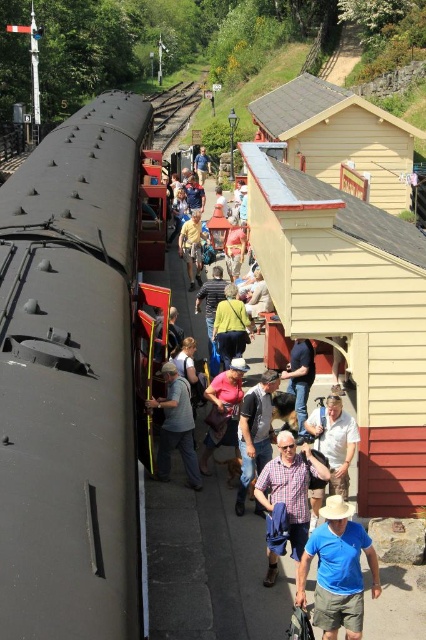
Who is more distant from viewer, (31, 472) or (181, 445)?

Positioned behind is point (181, 445).

Does point (14, 438) come farther from viewer compared to point (164, 403)?

No, it is not.

What do you see at coordinates (71, 380) in the screenshot?
I see `matte black train at left` at bounding box center [71, 380].

Find the location of a particular element. The height and width of the screenshot is (640, 426). matte black train at left is located at coordinates (71, 380).

Does matte black train at left have a greater height compared to matte black train at center?

Indeed, matte black train at left has a greater height compared to matte black train at center.

This screenshot has height=640, width=426. Find the location of `matte black train at left`. matte black train at left is located at coordinates (71, 380).

The width and height of the screenshot is (426, 640). What do you see at coordinates (71, 380) in the screenshot?
I see `matte black train at left` at bounding box center [71, 380].

This screenshot has width=426, height=640. Identify the location of matte black train at left. (71, 380).

Which is below, matte black train at center or light brown leather jacket at center?

matte black train at center is lower down.

Which of these two, matte black train at center or light brown leather jacket at center, stands shorter?

Standing shorter between the two is light brown leather jacket at center.

What do you see at coordinates (210, 564) in the screenshot? The height and width of the screenshot is (640, 426). I see `matte black train at center` at bounding box center [210, 564].

Identify the location of matte black train at center. (210, 564).